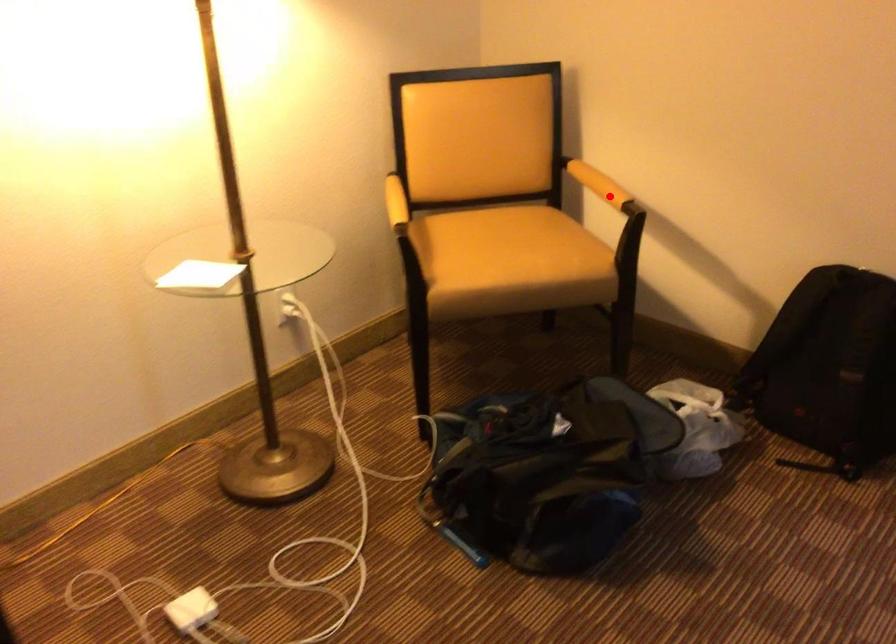
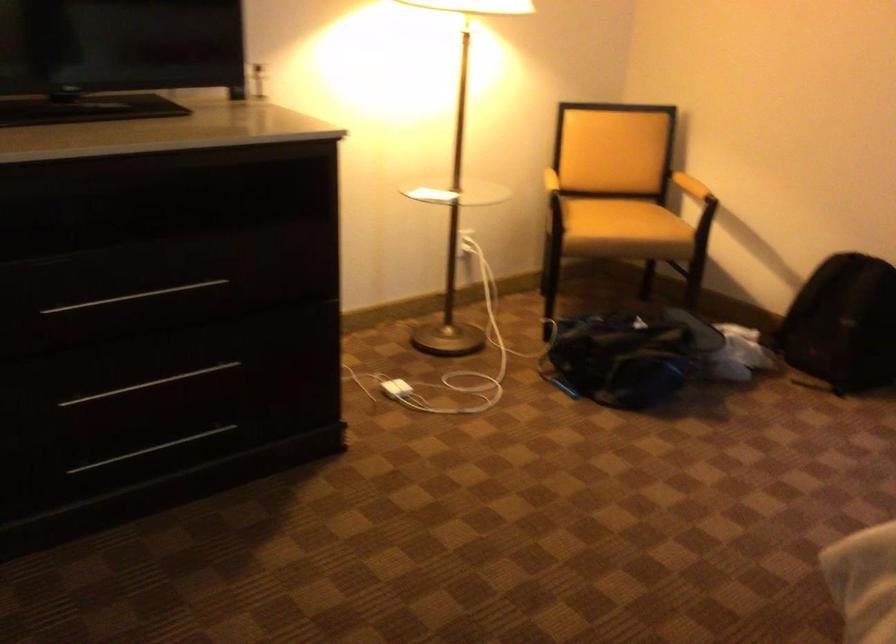
In the second image, find the point that corresponds to the highlighted location in the first image.

(690, 185)